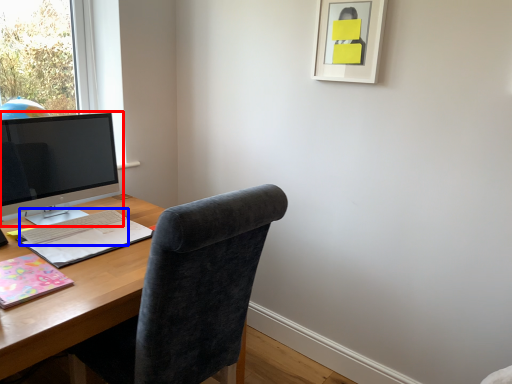
Question: Which object appears closest to the camera in this image, computer monitor (highlighted by a red box) or computer keyboard (highlighted by a blue box)?

Choices:
 (A) computer monitor
 (B) computer keyboard

Answer: (A)